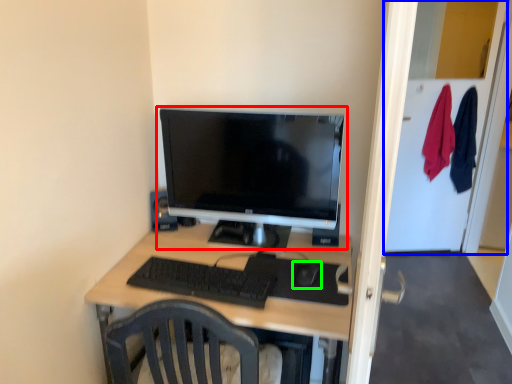
Question: Considering the real-world distances, which object is farthest from computer monitor (highlighted by a red box)? glass door (highlighted by a blue box) or mouse (highlighted by a green box)?

Choices:
 (A) glass door
 (B) mouse

Answer: (A)